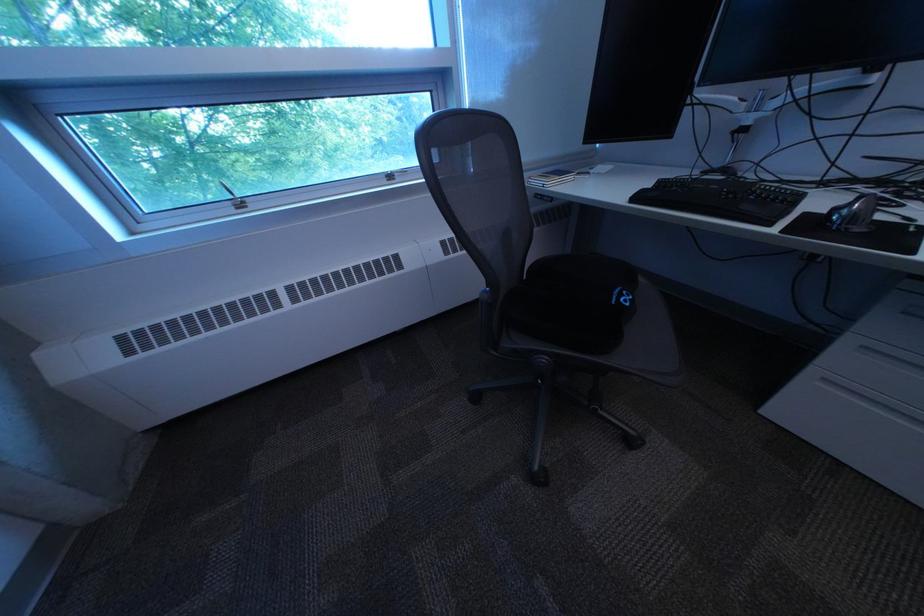
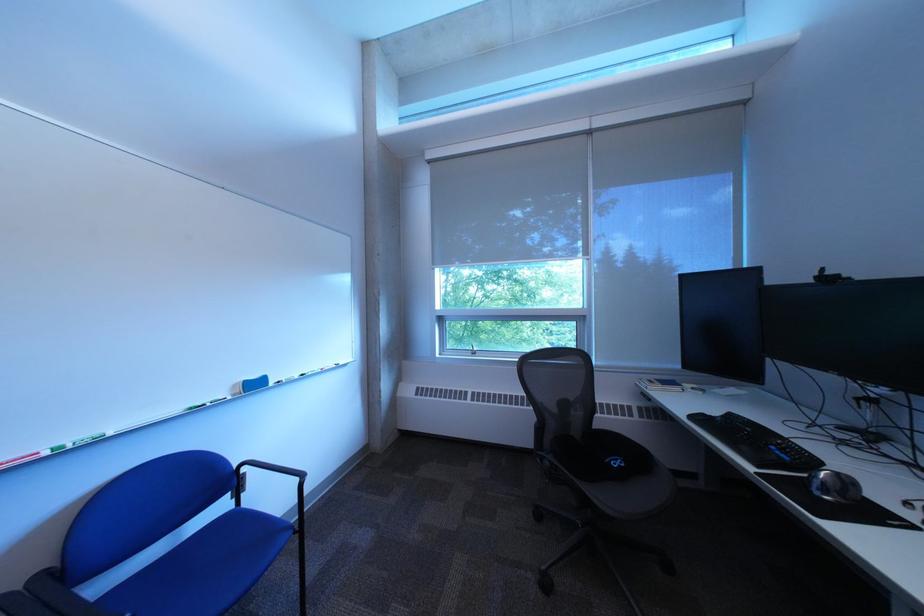
The point at (560, 362) is marked in the first image. Where is the corresponding point in the second image?

(563, 464)